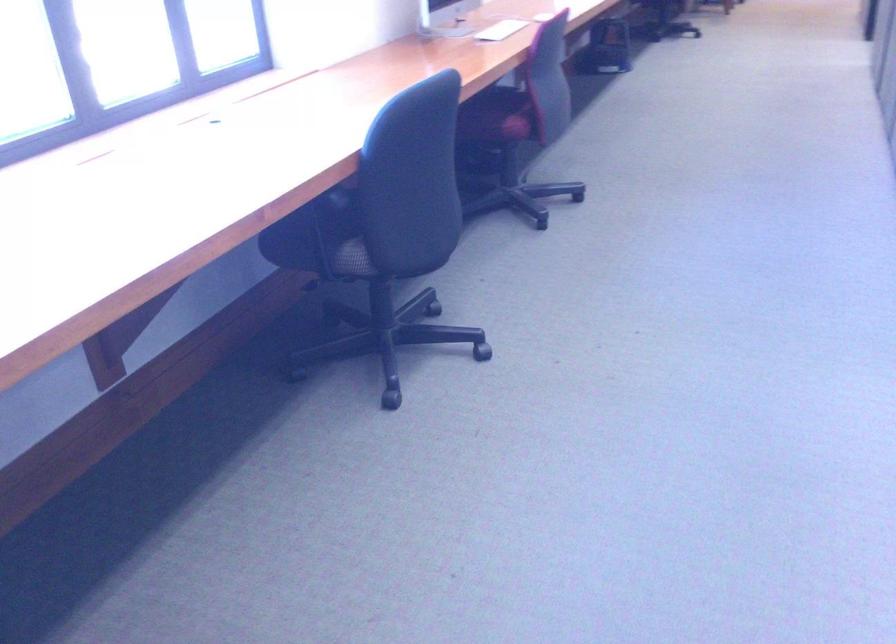
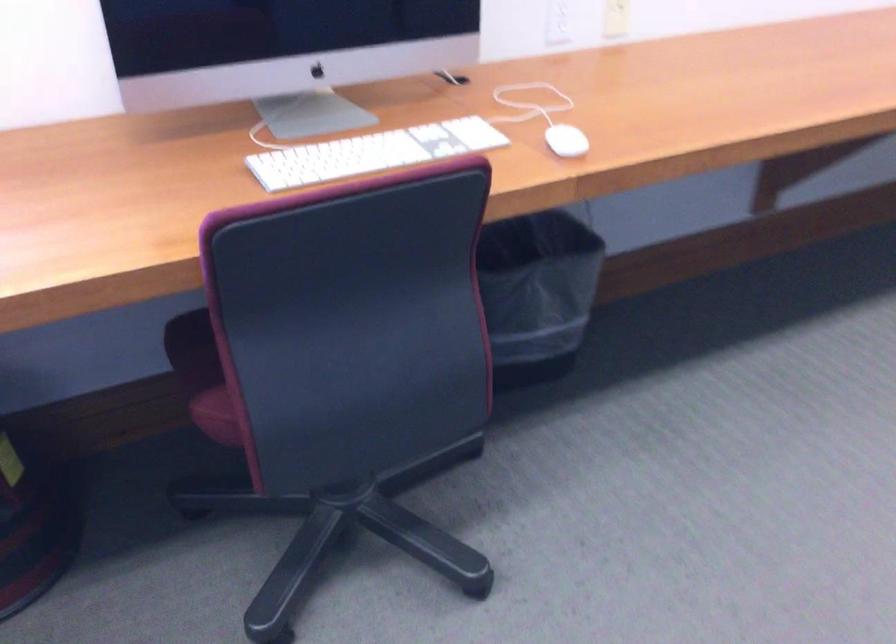
Locate, in the second image, the point that corresponds to (x=521, y=117) in the first image.

(220, 413)